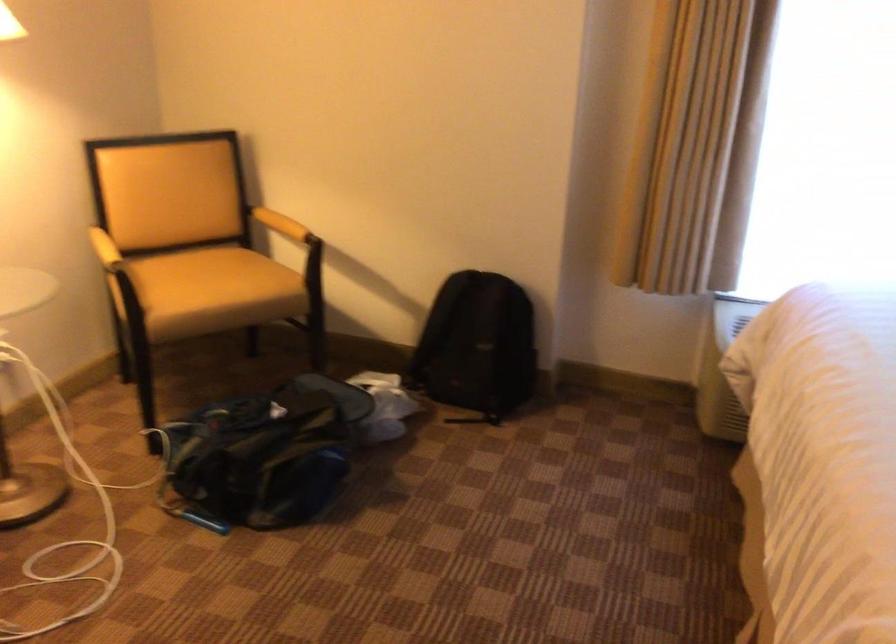
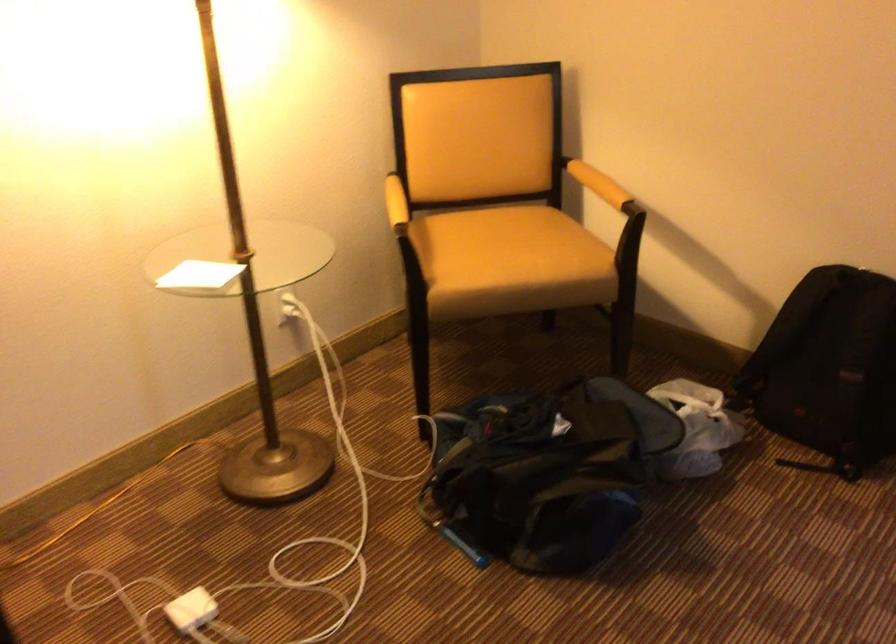
Locate, in the second image, the point that corresponds to the point at 471,350 in the first image.

(829, 368)